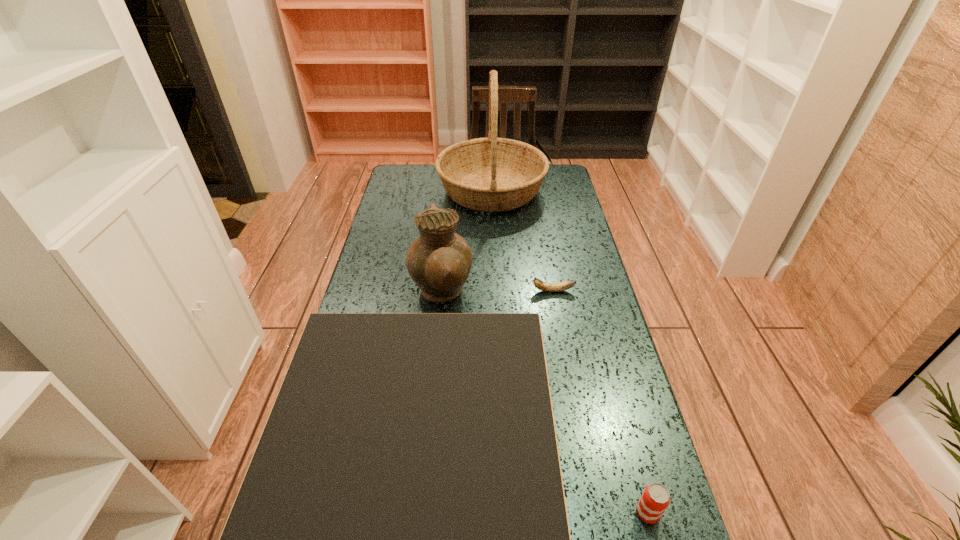
At what (x,y) coordinates should I click in order to perform the action: click on vacant point located 0.400m on the peel of the banana. Please return your answer as a coordinate pair (x, y). The height and width of the screenshot is (540, 960). Looking at the image, I should click on (403, 291).

Locate an element on the screen. The width and height of the screenshot is (960, 540). vacant area situated 0.290m on the peel of the banana is located at coordinates (438, 291).

At what (x,y) coordinates should I click in order to perform the action: click on object that is at the far edge. Please return your answer as a coordinate pair (x, y). This screenshot has height=540, width=960. Looking at the image, I should click on (490, 174).

The width and height of the screenshot is (960, 540). What are the coordinates of `object present at the left edge` in the screenshot? It's located at pyautogui.click(x=439, y=261).

You are a GUI agent. You are given a task and a screenshot of the screen. Output one action in this format:
    pyautogui.click(x=<x>, y=<y>)
    Task: Click on the basket at the right edge
    
    Given the screenshot: What is the action you would take?
    pyautogui.click(x=490, y=174)

Locate an element on the screen. beer can positioned at the right edge is located at coordinates (655, 499).

At what (x,y) coordinates should I click in order to perform the action: click on banana that is at the right edge. Please return your answer as a coordinate pair (x, y). Looking at the image, I should click on pos(544,286).

Locate an element on the screen. This screenshot has height=540, width=960. object present at the far right corner is located at coordinates (490, 174).

In the image, there is a desktop. Identify the location of vacant space at the left edge. This screenshot has height=540, width=960. (412, 207).

The height and width of the screenshot is (540, 960). Identify the location of free space at the right edge of the desktop. (587, 284).